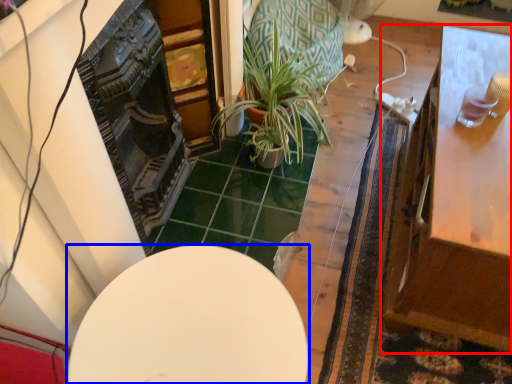
Question: Which of the following is the farthest to the observer, table (highlighted by a red box) or table (highlighted by a blue box)?

Choices:
 (A) table
 (B) table

Answer: (A)